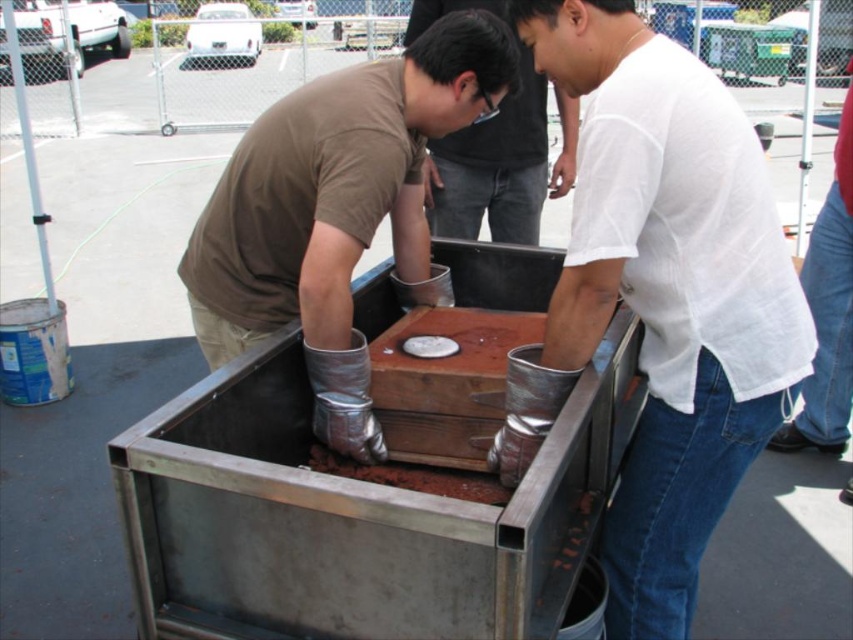
Question: Can you confirm if silver metallic gloves at center is positioned to the left of matte black shirt at center?

Choices:
 (A) yes
 (B) no

Answer: (A)

Question: Can you confirm if silver metallic gloves at center is positioned above matte black shirt at center?

Choices:
 (A) no
 (B) yes

Answer: (A)

Question: Which point is closer to the camera?

Choices:
 (A) silver metallic gloves at center
 (B) matte black shirt at center

Answer: (A)

Question: Among these objects, which one is farthest from the camera?

Choices:
 (A) matte black shirt at center
 (B) silver metallic gloves at center

Answer: (A)

Question: Among these points, which one is nearest to the camera?

Choices:
 (A) (569, 172)
 (B) (415, 198)

Answer: (B)

Question: Can you confirm if silver metallic gloves at center is bigger than matte black shirt at center?

Choices:
 (A) yes
 (B) no

Answer: (A)